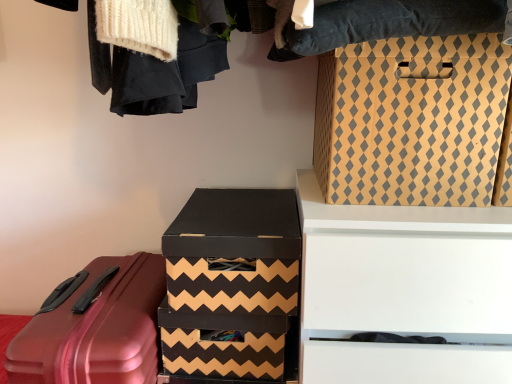
What is the approximate width of brown zigzag-patterned box at center, placed as the 3th box when sorted from top to bottom?

It is 28.59 centimeters.

The width and height of the screenshot is (512, 384). What do you see at coordinates (227, 347) in the screenshot?
I see `brown zigzag-patterned box at center, placed as the 3th box when sorted from top to bottom` at bounding box center [227, 347].

What do you see at coordinates (404, 290) in the screenshot? This screenshot has width=512, height=384. I see `white matte drawer at upper right` at bounding box center [404, 290].

What do you see at coordinates (96, 330) in the screenshot? I see `shiny red suitcase at lower left` at bounding box center [96, 330].

This screenshot has height=384, width=512. Find the location of `matte cardboard box at upper right, the 3th box in the bottom-to-top sequence`. matte cardboard box at upper right, the 3th box in the bottom-to-top sequence is located at coordinates (412, 120).

The width and height of the screenshot is (512, 384). Find the location of `brown zigzag-patterned box at center, positioned as the first box in bottom-to-top order`. brown zigzag-patterned box at center, positioned as the first box in bottom-to-top order is located at coordinates (227, 347).

Can you tell me how much shiny red suitcase at lower left and black cardboard box at center, marked as the 2th box in a bottom-to-top arrangement, differ in facing direction?

shiny red suitcase at lower left and black cardboard box at center, marked as the 2th box in a bottom-to-top arrangement, are facing 0.000313 degrees away from each other.

Is shiny red suitcase at lower left directly adjacent to black cardboard box at center, the second box from the top?

No, shiny red suitcase at lower left is not making contact with black cardboard box at center, the second box from the top.

Considering the points (133, 354) and (253, 274), which point is behind, point (133, 354) or point (253, 274)?

Point (253, 274)

Based on the photo, is shiny red suitcase at lower left shorter than black cardboard box at center, the second box from the top?

In fact, shiny red suitcase at lower left may be taller than black cardboard box at center, the second box from the top.

From a real-world perspective, which is physically above, brown zigzag-patterned box at center, positioned as the first box in bottom-to-top order, or black cardboard box at center, marked as the 2th box in a bottom-to-top arrangement?

black cardboard box at center, marked as the 2th box in a bottom-to-top arrangement.

Would you say black cardboard box at center, marked as the 2th box in a bottom-to-top arrangement, is part of brown zigzag-patterned box at center, placed as the 3th box when sorted from top to bottom,'s contents?

No.

Looking at this image, considering the relative sizes of brown zigzag-patterned box at center, positioned as the first box in bottom-to-top order, and black cardboard box at center, marked as the 2th box in a bottom-to-top arrangement, in the image provided, is brown zigzag-patterned box at center, positioned as the first box in bottom-to-top order, thinner than black cardboard box at center, marked as the 2th box in a bottom-to-top arrangement,?

Yes.

Where is `box below the black cardboard box at center, marked as the 2th box in a bottom-to-top arrangement (from the image's perspective)`? Image resolution: width=512 pixels, height=384 pixels. box below the black cardboard box at center, marked as the 2th box in a bottom-to-top arrangement (from the image's perspective) is located at coordinates (227, 347).

Based on the photo, can you tell me how much white matte drawer at upper right and black cardboard box at center, the second box from the top, differ in facing direction?

0.0298 degrees.

Is white matte drawer at upper right situated inside black cardboard box at center, marked as the 2th box in a bottom-to-top arrangement, or outside?

white matte drawer at upper right cannot be found inside black cardboard box at center, marked as the 2th box in a bottom-to-top arrangement.

Who is shorter, white matte drawer at upper right or black cardboard box at center, marked as the 2th box in a bottom-to-top arrangement?

black cardboard box at center, marked as the 2th box in a bottom-to-top arrangement, is shorter.

Looking at this image, considering the sizes of objects white matte drawer at upper right and black cardboard box at center, marked as the 2th box in a bottom-to-top arrangement, in the image provided, who is bigger, white matte drawer at upper right or black cardboard box at center, marked as the 2th box in a bottom-to-top arrangement,?

white matte drawer at upper right.

From a real-world perspective, is shiny red suitcase at lower left physically located above or below brown zigzag-patterned box at center, placed as the 3th box when sorted from top to bottom?

From a real-world perspective, shiny red suitcase at lower left is physically below brown zigzag-patterned box at center, placed as the 3th box when sorted from top to bottom.

Is shiny red suitcase at lower left bigger than brown zigzag-patterned box at center, placed as the 3th box when sorted from top to bottom?

Indeed, shiny red suitcase at lower left has a larger size compared to brown zigzag-patterned box at center, placed as the 3th box when sorted from top to bottom.

Would you say brown zigzag-patterned box at center, positioned as the first box in bottom-to-top order, is part of shiny red suitcase at lower left's contents?

No.

Relative to white matte drawer at upper right, is brown zigzag-patterned box at center, positioned as the first box in bottom-to-top order, in front or behind?

Clearly, brown zigzag-patterned box at center, positioned as the first box in bottom-to-top order, is behind white matte drawer at upper right.

Is brown zigzag-patterned box at center, positioned as the first box in bottom-to-top order, bigger than white matte drawer at upper right?

Actually, brown zigzag-patterned box at center, positioned as the first box in bottom-to-top order, might be smaller than white matte drawer at upper right.

Which is correct: brown zigzag-patterned box at center, placed as the 3th box when sorted from top to bottom, is inside white matte drawer at upper right, or outside of it?

brown zigzag-patterned box at center, placed as the 3th box when sorted from top to bottom, cannot be found inside white matte drawer at upper right.

Which point is more distant from viewer, (41, 319) or (318, 161)?

The point (318, 161) is more distant.

Is shiny red suitcase at lower left outside of matte cardboard box at upper right, arranged as the 1th box when viewed from the top?

Absolutely, shiny red suitcase at lower left is external to matte cardboard box at upper right, arranged as the 1th box when viewed from the top.

How far apart are shiny red suitcase at lower left and matte cardboard box at upper right, the 3th box in the bottom-to-top sequence?

The distance of shiny red suitcase at lower left from matte cardboard box at upper right, the 3th box in the bottom-to-top sequence, is 24.51 inches.

From the picture: Between shiny red suitcase at lower left and matte cardboard box at upper right, the 3th box in the bottom-to-top sequence, which one has more height?

shiny red suitcase at lower left.

Which object is wider, white matte drawer at upper right or shiny red suitcase at lower left?

With larger width is shiny red suitcase at lower left.

Where is `suitcase that appears behind the white matte drawer at upper right`? This screenshot has height=384, width=512. suitcase that appears behind the white matte drawer at upper right is located at coordinates (96, 330).

From a real-world perspective, is white matte drawer at upper right beneath shiny red suitcase at lower left?

No, from a real-world perspective, white matte drawer at upper right is not under shiny red suitcase at lower left.

How far apart are white matte drawer at upper right and shiny red suitcase at lower left?

They are 49.50 centimeters apart.

This screenshot has height=384, width=512. Identify the location of the 2nd box above the shiny red suitcase at lower left (from the image's perspective). (234, 251).

This screenshot has width=512, height=384. In order to click on the 1st box in front of the brown zigzag-patterned box at center, positioned as the first box in bottom-to-top order in this screenshot , I will do `click(234, 251)`.

From the image, which object appears to be farther from white matte drawer at upper right, matte cardboard box at upper right, arranged as the 1th box when viewed from the top, or brown zigzag-patterned box at center, positioned as the first box in bottom-to-top order?

brown zigzag-patterned box at center, positioned as the first box in bottom-to-top order, is positioned further to the anchor white matte drawer at upper right.

From the image, which object appears to be nearer to black cardboard box at center, the second box from the top, shiny red suitcase at lower left or white matte drawer at upper right?

Among the two, white matte drawer at upper right is located nearer to black cardboard box at center, the second box from the top.

Looking at the image, which one is located closer to brown zigzag-patterned box at center, positioned as the first box in bottom-to-top order, black cardboard box at center, marked as the 2th box in a bottom-to-top arrangement, or matte cardboard box at upper right, the 3th box in the bottom-to-top sequence?

Based on the image, black cardboard box at center, marked as the 2th box in a bottom-to-top arrangement, appears to be nearer to brown zigzag-patterned box at center, positioned as the first box in bottom-to-top order.

Which object lies nearer to the anchor point shiny red suitcase at lower left, brown zigzag-patterned box at center, placed as the 3th box when sorted from top to bottom, or matte cardboard box at upper right, arranged as the 1th box when viewed from the top?

Among the two, brown zigzag-patterned box at center, placed as the 3th box when sorted from top to bottom, is located nearer to shiny red suitcase at lower left.

Which object lies nearer to the anchor point white matte drawer at upper right, matte cardboard box at upper right, arranged as the 1th box when viewed from the top, or shiny red suitcase at lower left?

matte cardboard box at upper right, arranged as the 1th box when viewed from the top, is closer to white matte drawer at upper right.

When comparing their distances from shiny red suitcase at lower left, does white matte drawer at upper right or black cardboard box at center, the second box from the top, seem closer?

black cardboard box at center, the second box from the top, is positioned closer to the anchor shiny red suitcase at lower left.

From the image, which object appears to be farther from black cardboard box at center, the second box from the top, matte cardboard box at upper right, the 3th box in the bottom-to-top sequence, or brown zigzag-patterned box at center, placed as the 3th box when sorted from top to bottom?

Answer: matte cardboard box at upper right, the 3th box in the bottom-to-top sequence, lies further to black cardboard box at center, the second box from the top, than the other object.

Estimate the real-world distances between objects in this image. Which object is further from shiny red suitcase at lower left, matte cardboard box at upper right, the 3th box in the bottom-to-top sequence, or brown zigzag-patterned box at center, positioned as the first box in bottom-to-top order?

The object further to shiny red suitcase at lower left is matte cardboard box at upper right, the 3th box in the bottom-to-top sequence.

This screenshot has height=384, width=512. In order to click on box between shiny red suitcase at lower left and black cardboard box at center, the second box from the top, from left to right in this screenshot , I will do `click(227, 347)`.

Where is `box that lies between matte cardboard box at upper right, arranged as the 1th box when viewed from the top, and brown zigzag-patterned box at center, positioned as the first box in bottom-to-top order, from top to bottom`? Image resolution: width=512 pixels, height=384 pixels. box that lies between matte cardboard box at upper right, arranged as the 1th box when viewed from the top, and brown zigzag-patterned box at center, positioned as the first box in bottom-to-top order, from top to bottom is located at coordinates (234, 251).